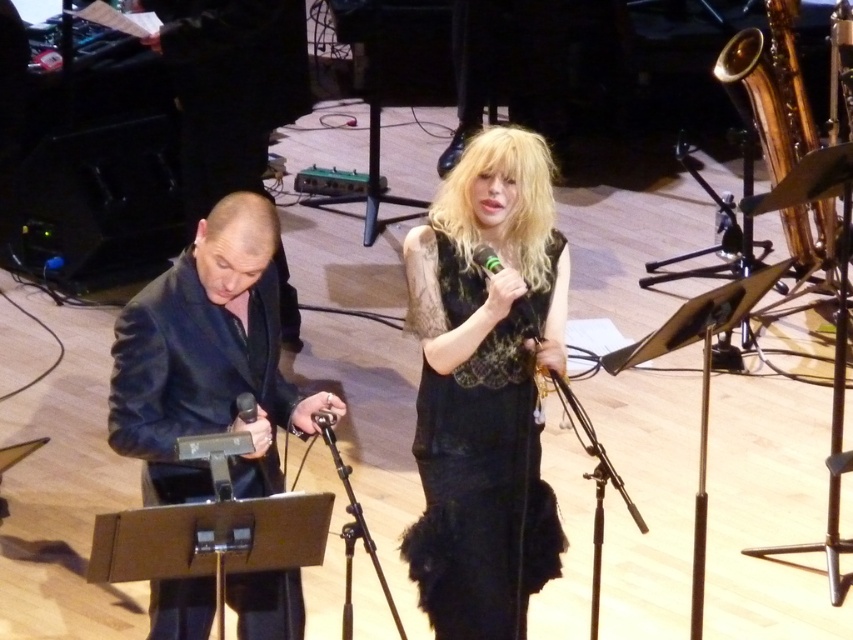
Question: Considering the real-world distances, which object is farthest from the dark blue suit at left?

Choices:
 (A) green metallic microphone at center
 (B) black matte microphone at center
 (C) black lace dress at center

Answer: (A)

Question: Is dark blue suit at left smaller than black matte microphone at center?

Choices:
 (A) no
 (B) yes

Answer: (A)

Question: Does dark blue suit at left have a larger size compared to green metallic microphone at center?

Choices:
 (A) no
 (B) yes

Answer: (B)

Question: Is black lace dress at center thinner than dark blue suit at left?

Choices:
 (A) no
 (B) yes

Answer: (B)

Question: Based on their relative distances, which object is farther from the black lace dress at center?

Choices:
 (A) black matte microphone at center
 (B) green metallic microphone at center
 (C) dark blue suit at left

Answer: (A)

Question: Which point is closer to the camera?

Choices:
 (A) (245, 397)
 (B) (474, 465)
 (C) (300, 416)

Answer: (A)